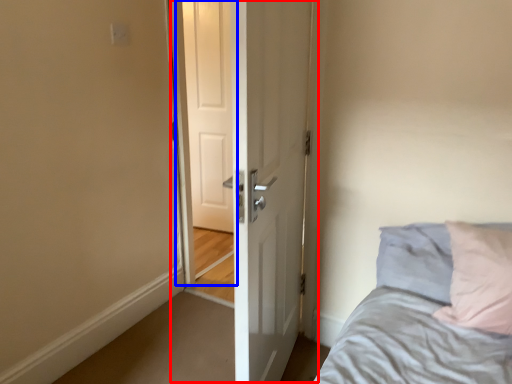
Question: Which of the following is the farthest to the observer, door (highlighted by a red box) or screen door (highlighted by a blue box)?

Choices:
 (A) door
 (B) screen door

Answer: (B)